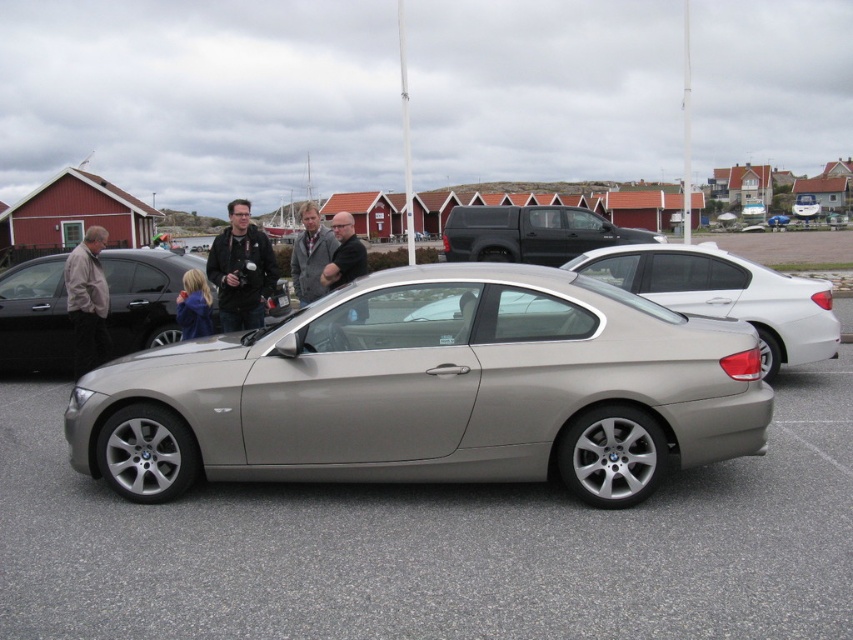
Question: Considering the real-world distances, which object is farthest from the light brown leather jacket at left?

Choices:
 (A) satin black truck at center
 (B) blue fabric jacket at center
 (C) matte black car at left
 (D) matte black jacket at center

Answer: (A)

Question: Does satin metallic car at center come behind satin silver car at center?

Choices:
 (A) yes
 (B) no

Answer: (B)

Question: Which object appears closest to the camera in this image?

Choices:
 (A) matte black car at left
 (B) satin silver car at center
 (C) matte black jacket at center
 (D) satin black truck at center

Answer: (C)

Question: Does gray wool coat at center come behind blue fabric jacket at center?

Choices:
 (A) yes
 (B) no

Answer: (B)

Question: Among these objects, which one is farthest from the camera?

Choices:
 (A) satin metallic car at center
 (B) matte black jacket at center

Answer: (B)

Question: Can you confirm if light brown leather jacket at left is smaller than blue fabric jacket at center?

Choices:
 (A) yes
 (B) no

Answer: (B)